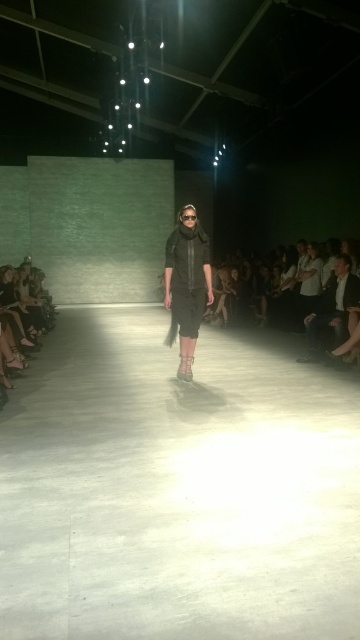
Question: Which of the following is the closest to the observer?

Choices:
 (A) black matte dress at center
 (B) dark gray jeans at right

Answer: (A)

Question: Does black matte dress at center have a greater width compared to dark gray jeans at right?

Choices:
 (A) yes
 (B) no

Answer: (B)

Question: Can you confirm if black matte dress at center is positioned to the right of dark gray jeans at right?

Choices:
 (A) no
 (B) yes

Answer: (A)

Question: Is black matte dress at center below dark gray jeans at right?

Choices:
 (A) yes
 (B) no

Answer: (B)